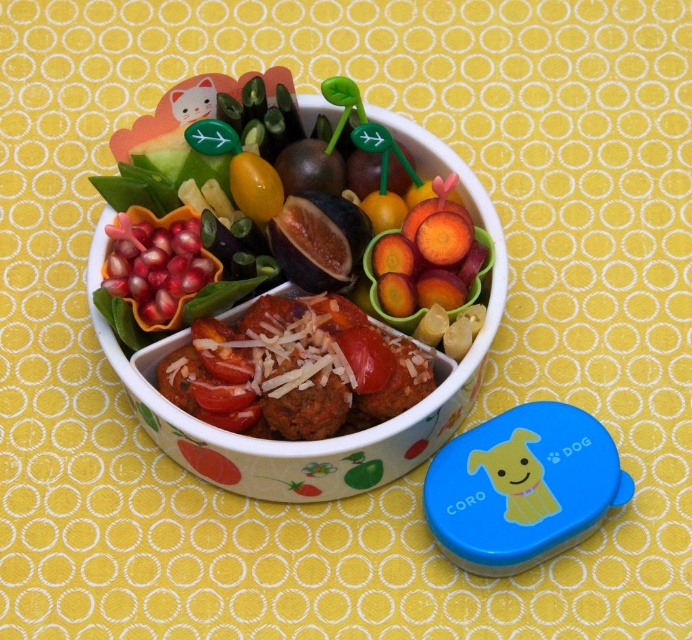
You are a food critic standing 1 meter away from a bento box. You want to taste the brown matte meatballs at center. Can you reach them without moving closer?

The brown matte meatballs at center is 1.26 meters away from viewer, so you cannot reach them without moving closer as you are only 1 meter away.

You are preparing to place a spoon into the white glossy bowl at center and the pomegranate seeds at center. Which container can hold more food?

The white glossy bowl at center has a larger size compared to pomegranate seeds at center, so it can hold more food.